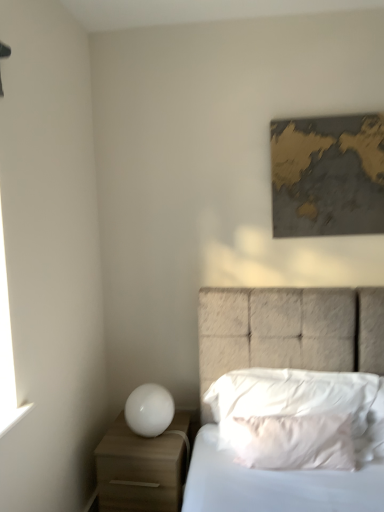
Locate an element on the screen. free space in front of white glossy sphere at lower left is located at coordinates (145, 450).